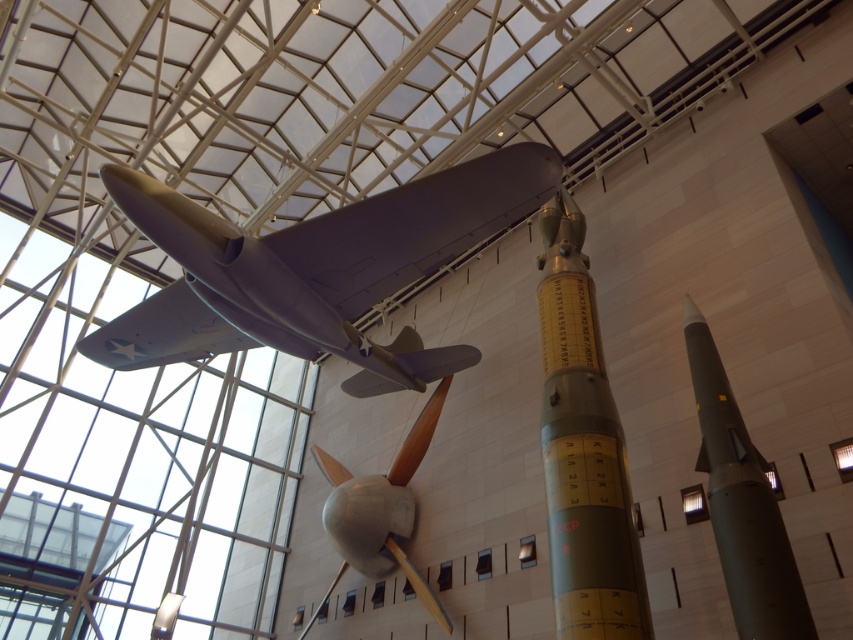
Question: Which of the following is the farthest from the observer?

Choices:
 (A) (589, 349)
 (B) (788, 557)

Answer: (A)

Question: Is matte gray airplane at center closer to the viewer compared to green metallic rocket at center?

Choices:
 (A) yes
 (B) no

Answer: (B)

Question: Is green metallic rocket at center below silver metallic propeller at center?

Choices:
 (A) no
 (B) yes

Answer: (A)

Question: Estimate the real-world distances between objects in this image. Which object is farther from the silver metallic propeller at center?

Choices:
 (A) matte gray rocket at right
 (B) matte gray airplane at center
 (C) green metallic rocket at center

Answer: (A)

Question: Which object appears farthest from the camera in this image?

Choices:
 (A) matte gray rocket at right
 (B) green metallic rocket at center
 (C) silver metallic propeller at center

Answer: (C)

Question: Is matte gray rocket at right positioned before silver metallic propeller at center?

Choices:
 (A) yes
 (B) no

Answer: (A)